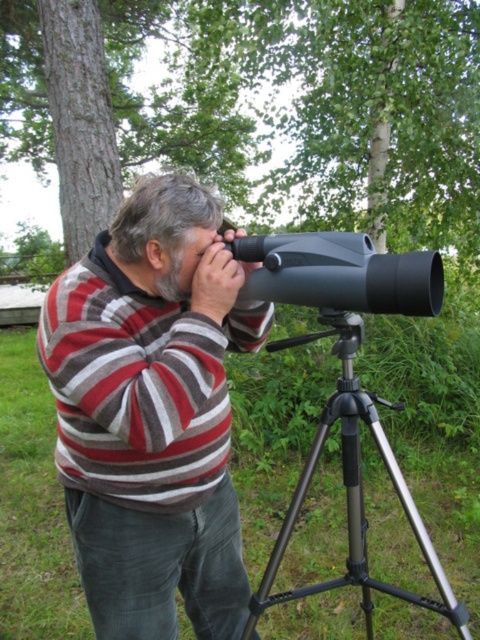
You are a photographer trying to capture the person using the spotting scope. You want to ensure both the striped sweater at center and the black metallic tripod at center are clearly visible in your shot. Given their sizes, which object should you focus on first to ensure it fits within the frame?

The striped sweater at center occupies less space than the black metallic tripod at center, so you should focus on the black metallic tripod at center first to ensure it fits within the frame, and then adjust to include the smaller striped sweater at center.

You are trying to set up a camera on the black plastic telescope at center. To do this, you need to know where the black metallic tripod at center is in relation to it. Is the tripod above or below the telescope?

The black metallic tripod at center is located below the black plastic telescope at center, so the tripod is below the telescope.

Looking at this image, you are a photographer wanting to set up a tripod to the left of your telescope. Looking at the scene, is the black metallic tripod at center already positioned to the left of the black plastic telescope at center?

The black metallic tripod at center is to the right of black plastic telescope at center, so it is not positioned to the left of the telescope. You need to move it to the left.